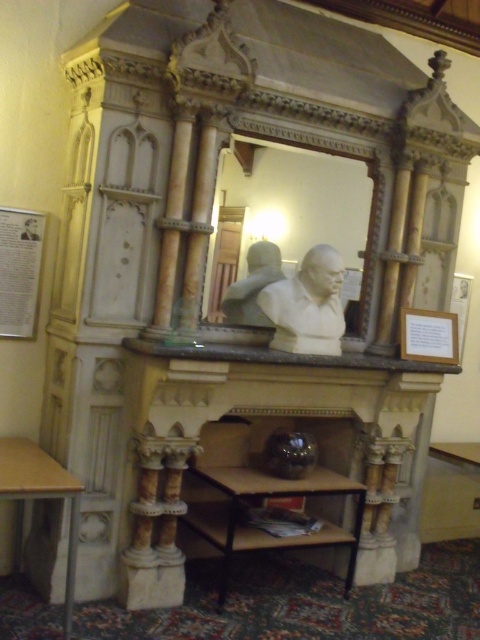
You are arranging flowers for an event and have two tables available. You need to place a large centerpiece that requires a table wider than 1 meter. Which table between the metallic black table at center and the wooden table at lower left should you choose?

The metallic black table at center should be chosen because its width surpasses that of the wooden table at lower left, ensuring it can accommodate the large centerpiece requiring a table wider than 1 meter.

You are standing in front of the ornate stone structure and want to place a 10 feet long decorative banner on the metallic black table at center. Can you determine if the banner will fit on the table?

The metallic black table at center is 10.19 feet away from the viewer. Since the banner is 10 feet long, it will fit on the table as the distance between the table and viewer is greater than the banner length.